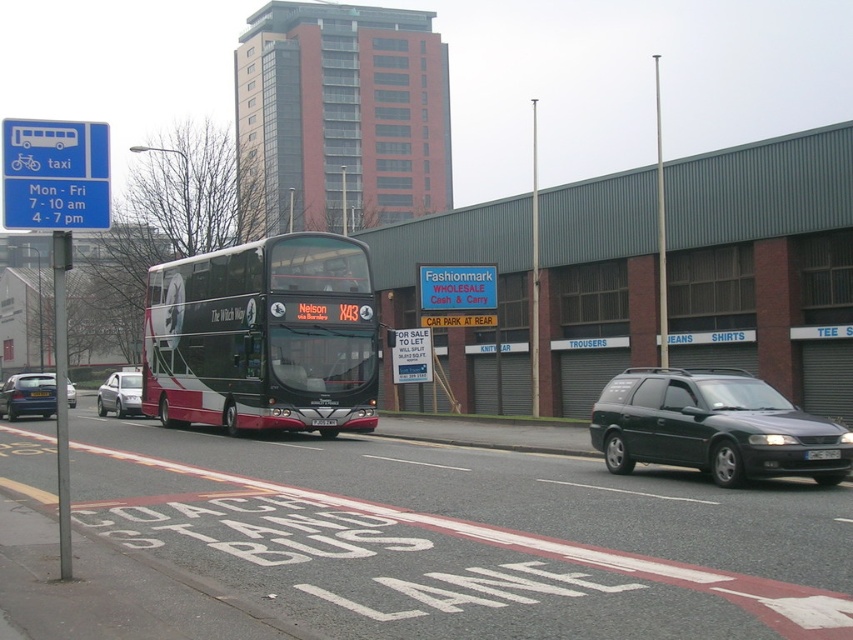
Is silver metallic sedan at center-left below white plastic license plate at center?

Correct, silver metallic sedan at center-left is located below white plastic license plate at center.

Who is more forward, (138, 380) or (822, 456)?

Point (822, 456)

What do you see at coordinates (120, 394) in the screenshot? Image resolution: width=853 pixels, height=640 pixels. I see `silver metallic sedan at center-left` at bounding box center [120, 394].

At what (x,y) coordinates should I click in order to perform the action: click on silver metallic sedan at center-left. Please return your answer as a coordinate pair (x, y). Image resolution: width=853 pixels, height=640 pixels. Looking at the image, I should click on (120, 394).

Is black metallic bus at center to the left of silver metallic sedan at center-left from the viewer's perspective?

No, black metallic bus at center is not to the left of silver metallic sedan at center-left.

Does black metallic bus at center appear over silver metallic sedan at center-left?

Indeed, black metallic bus at center is positioned over silver metallic sedan at center-left.

This screenshot has height=640, width=853. What do you see at coordinates (263, 337) in the screenshot? I see `black metallic bus at center` at bounding box center [263, 337].

The height and width of the screenshot is (640, 853). Identify the location of black metallic bus at center. (263, 337).

Is black metallic bus at center thinner than matte black station wagon at right?

No, black metallic bus at center is not thinner than matte black station wagon at right.

Who is taller, black metallic bus at center or matte black station wagon at right?

Standing taller between the two is black metallic bus at center.

What do you see at coordinates (263, 337) in the screenshot? This screenshot has width=853, height=640. I see `black metallic bus at center` at bounding box center [263, 337].

The width and height of the screenshot is (853, 640). In order to click on black metallic bus at center in this screenshot , I will do `click(263, 337)`.